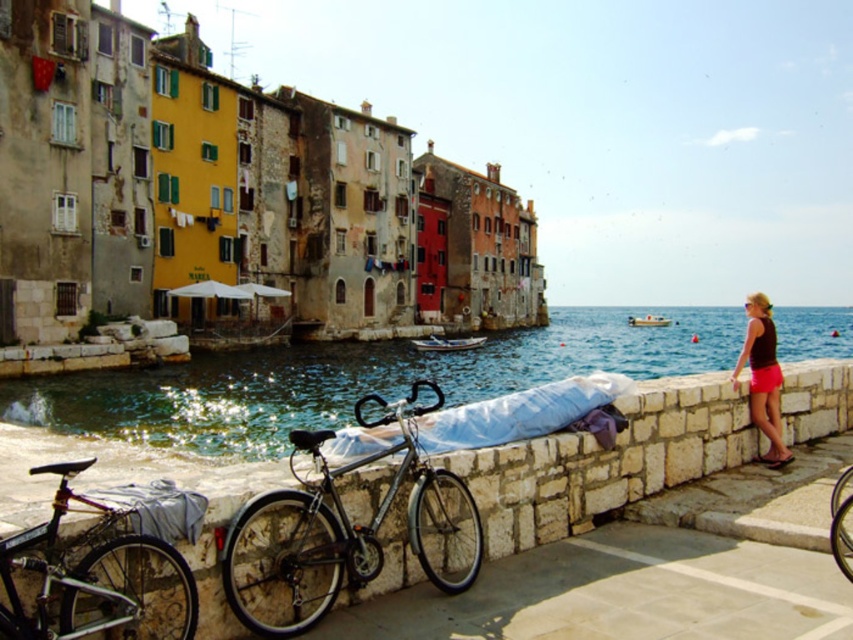
Between stone wall at lower center and shiny metallic bicycle at lower right, which one is positioned lower?

shiny metallic bicycle at lower right

Does stone wall at lower center appear on the left side of shiny metallic bicycle at lower right?

Yes, stone wall at lower center is to the left of shiny metallic bicycle at lower right.

Measure the distance between stone wall at lower center and camera.

stone wall at lower center is 67.65 feet away from camera.

Find the location of a particular element. stone wall at lower center is located at coordinates (607, 461).

Is clear blue water at lower center below shiny metallic bicycle at lower left?

No, clear blue water at lower center is not below shiny metallic bicycle at lower left.

Which is in front, point (224, 369) or point (85, 536)?

Point (85, 536) is more forward.

I want to click on clear blue water at lower center, so click(x=357, y=380).

Who is positioned more to the left, shiny metallic bicycle at lower left or shiny metallic bicycle at lower right?

From the viewer's perspective, shiny metallic bicycle at lower left appears more on the left side.

Does shiny metallic bicycle at lower left appear over shiny metallic bicycle at lower right?

Yes, shiny metallic bicycle at lower left is above shiny metallic bicycle at lower right.

Is point (119, 605) less distant than point (833, 508)?

Yes, point (119, 605) is in front of point (833, 508).

The width and height of the screenshot is (853, 640). Find the location of `shiny metallic bicycle at lower left`. shiny metallic bicycle at lower left is located at coordinates (96, 576).